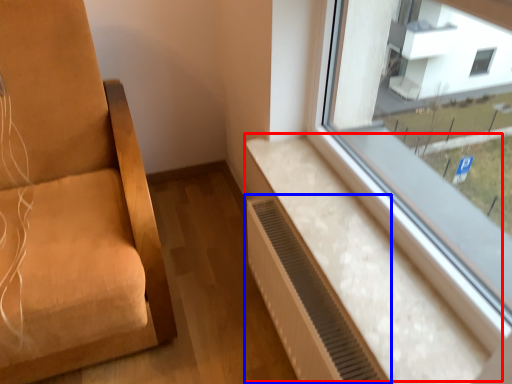
Question: Which object appears farthest to the camera in this image, window sill (highlighted by a red box) or air conditioner (highlighted by a blue box)?

Choices:
 (A) window sill
 (B) air conditioner

Answer: (B)